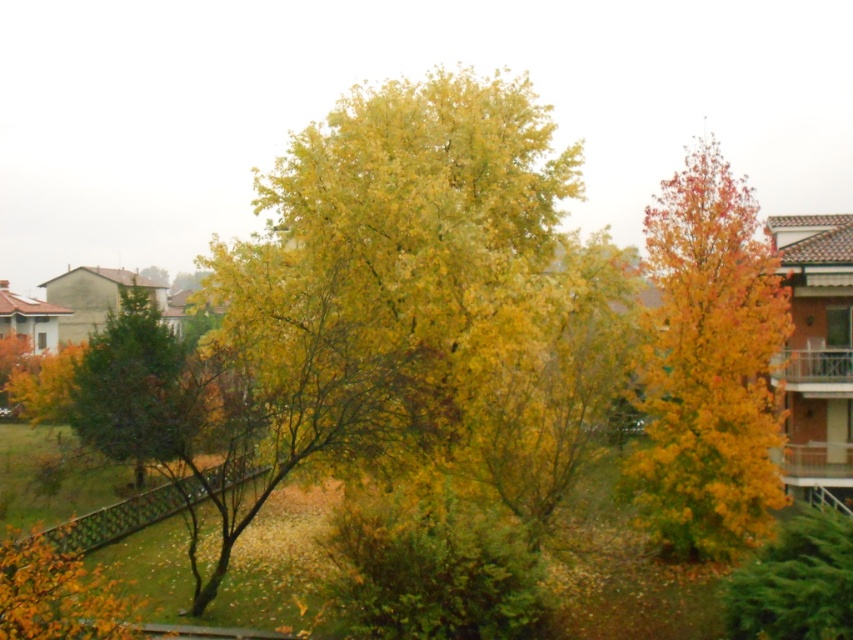
Question: Among these objects, which one is farthest from the camera?

Choices:
 (A) orange-brown textured tree at right
 (B) green matte tree at center

Answer: (A)

Question: Does orange-brown textured tree at right appear on the left side of green matte tree at center?

Choices:
 (A) yes
 (B) no

Answer: (B)

Question: Does orange-brown textured tree at right have a greater width compared to green matte tree at center?

Choices:
 (A) yes
 (B) no

Answer: (A)

Question: Which of the following is the farthest from the observer?

Choices:
 (A) orange-brown textured tree at right
 (B) green matte tree at center

Answer: (A)

Question: Does orange-brown textured tree at right appear on the right side of green matte tree at center?

Choices:
 (A) yes
 (B) no

Answer: (A)